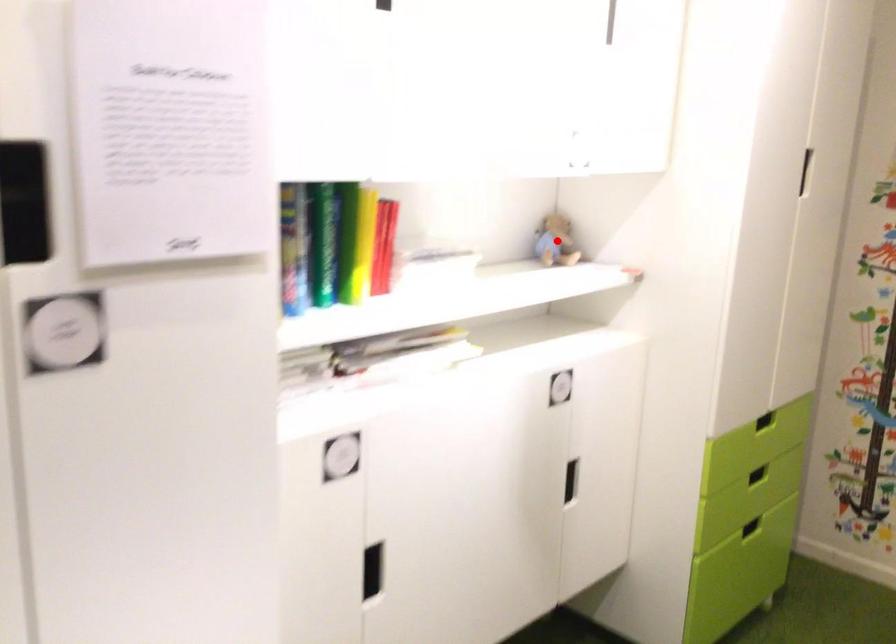
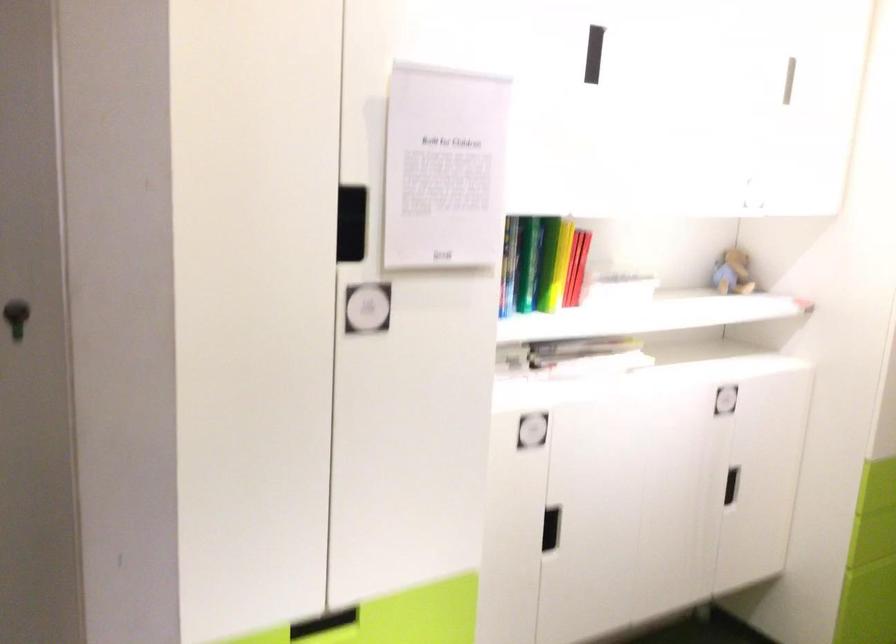
Where in the second image is the point corresponding to the highlighted location from the first image?

(733, 272)